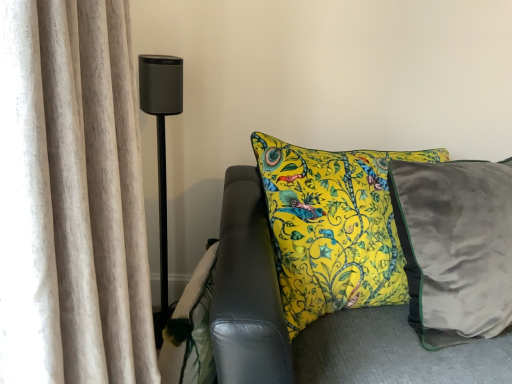
Question: From a real-world perspective, is beige textured curtain at left above or below matte black speaker at left?

Choices:
 (A) above
 (B) below

Answer: (A)

Question: In the image, is beige textured curtain at left positioned in front of or behind matte black speaker at left?

Choices:
 (A) behind
 (B) front

Answer: (B)

Question: Looking at the image, does beige textured curtain at left seem bigger or smaller compared to matte black speaker at left?

Choices:
 (A) small
 (B) big

Answer: (B)

Question: Is matte black speaker at left inside or outside of beige textured curtain at left?

Choices:
 (A) outside
 (B) inside

Answer: (A)

Question: From a real-world perspective, is matte black speaker at left physically located above or below beige textured curtain at left?

Choices:
 (A) below
 (B) above

Answer: (A)

Question: Looking at their shapes, would you say matte black speaker at left is wider or thinner than beige textured curtain at left?

Choices:
 (A) thin
 (B) wide

Answer: (A)

Question: Is matte black speaker at left bigger or smaller than beige textured curtain at left?

Choices:
 (A) big
 (B) small

Answer: (B)